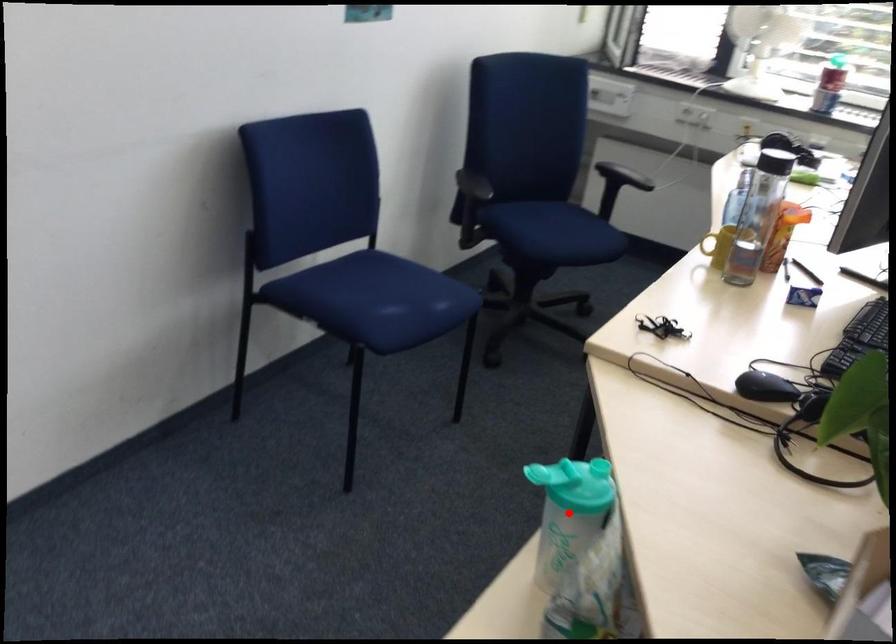
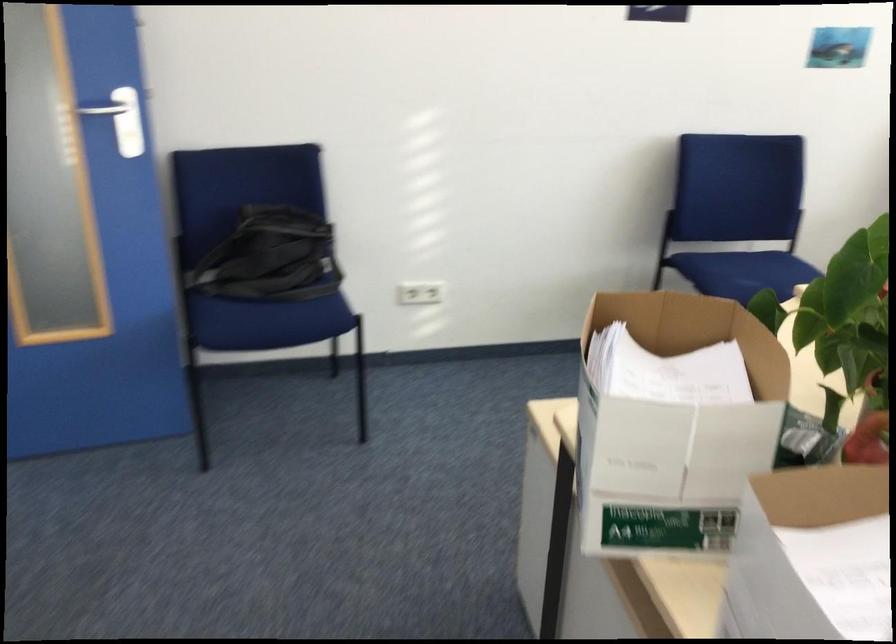
Question: I am providing you with two images of the same scene from different viewpoints. A red point is marked on the first image. At the location where the point appears in image 1, is it still visible in image 2?

Choices:
 (A) Yes
 (B) No

Answer: (B)